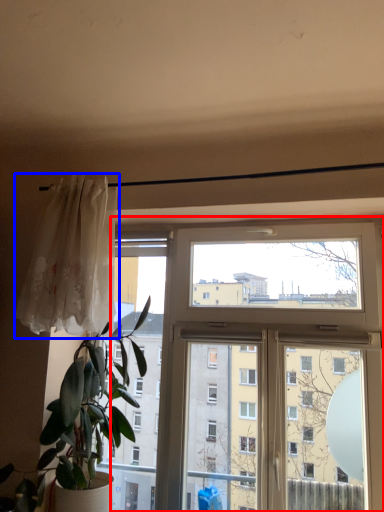
Question: Which object appears closest to the camera in this image, window (highlighted by a red box) or curtain (highlighted by a blue box)?

Choices:
 (A) window
 (B) curtain

Answer: (A)